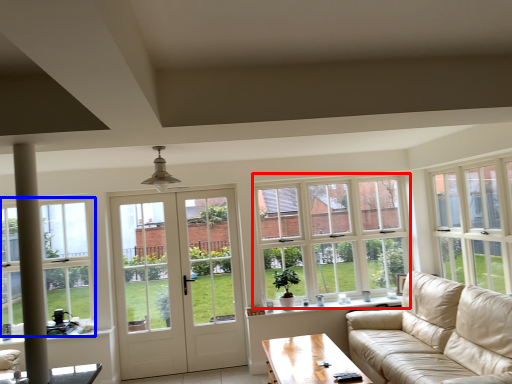
Question: Which object is further to the camera taking this photo, window (highlighted by a red box) or window (highlighted by a blue box)?

Choices:
 (A) window
 (B) window

Answer: (A)